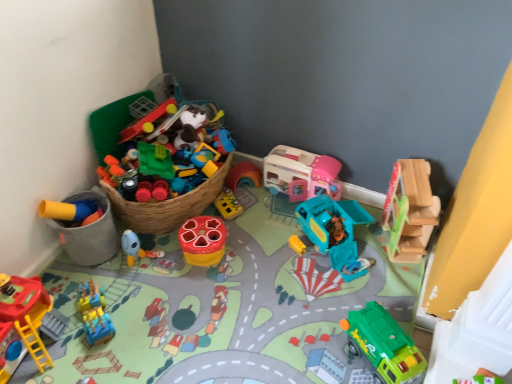
Where is `vacant area that lies to the right of blue rubber duck at center, which ranks as the sixth toy in right-to-left order`? The width and height of the screenshot is (512, 384). vacant area that lies to the right of blue rubber duck at center, which ranks as the sixth toy in right-to-left order is located at coordinates tap(178, 269).